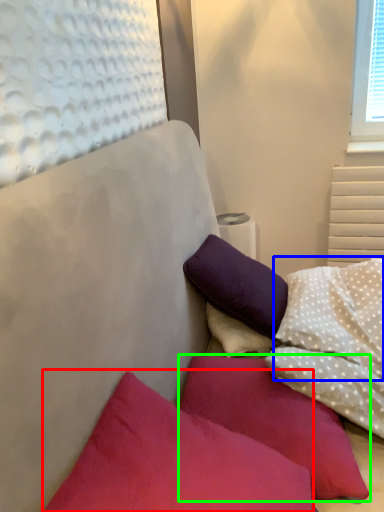
Question: Estimate the real-world distances between objects in this image. Which object is farther from pillow (highlighted by a red box), pillow (highlighted by a blue box) or pillow (highlighted by a green box)?

Choices:
 (A) pillow
 (B) pillow

Answer: (A)